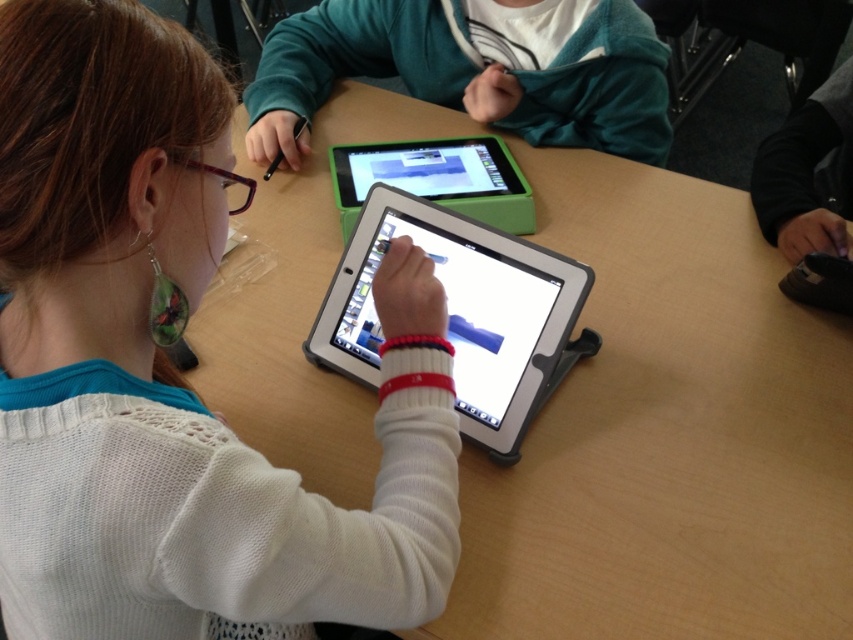
Does white matte sweater at center have a greater width compared to teal fleece hoodie at upper center?

Incorrect, white matte sweater at center's width does not surpass teal fleece hoodie at upper center's.

Who is shorter, white matte sweater at center or teal fleece hoodie at upper center?

Standing shorter between the two is teal fleece hoodie at upper center.

Who is more distant from viewer, (386, 548) or (537, 16)?

Positioned behind is point (537, 16).

Image resolution: width=853 pixels, height=640 pixels. Identify the location of white matte sweater at center. coord(167,381).

Who is taller, teal fleece hoodie at upper center or white plastic tablet at center?

Standing taller between the two is teal fleece hoodie at upper center.

Is point (454, 54) positioned before point (521, 243)?

That is False.

You are a GUI agent. You are given a task and a screenshot of the screen. Output one action in this format:
    pyautogui.click(x=<x>, y=<y>)
    Task: Click on the teal fleece hoodie at upper center
    
    Given the screenshot: What is the action you would take?
    pyautogui.click(x=471, y=72)

Is white plastic tablet at center thinner than green plastic tablet at upper center?

No.

Does white plastic tablet at center appear under green plastic tablet at upper center?

Indeed, white plastic tablet at center is positioned under green plastic tablet at upper center.

At what (x,y) coordinates should I click in order to perform the action: click on white plastic tablet at center. Please return your answer as a coordinate pair (x, y). Image resolution: width=853 pixels, height=640 pixels. Looking at the image, I should click on (463, 314).